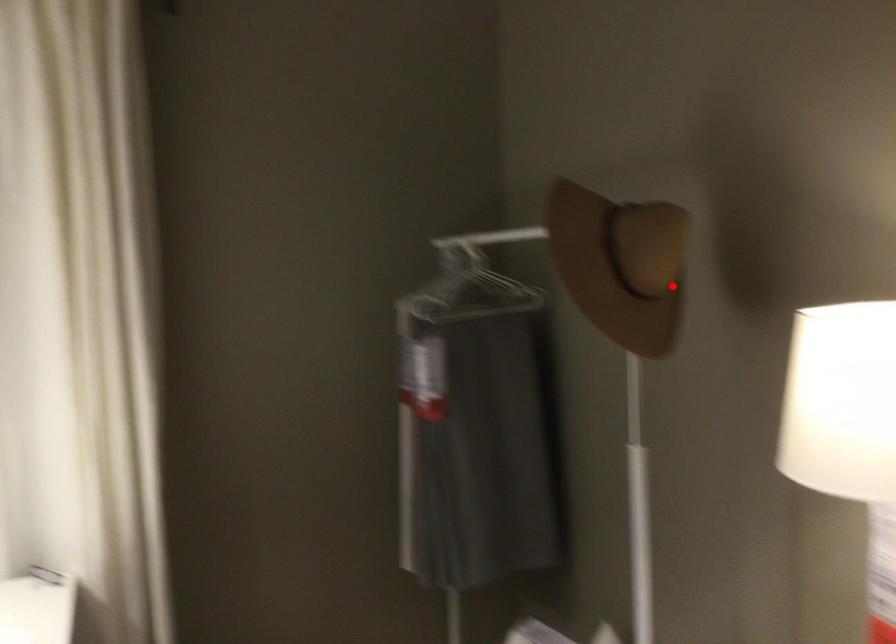
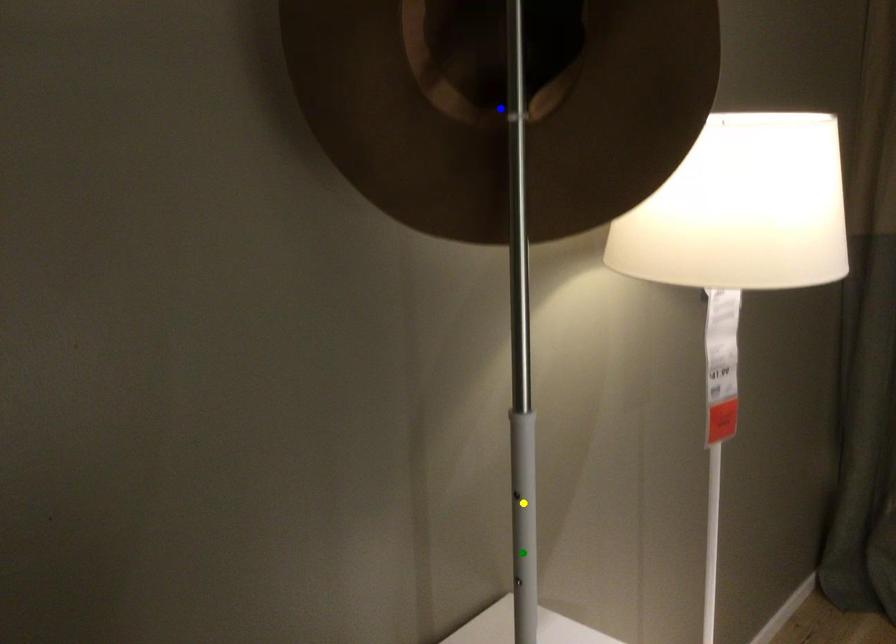
Question: I am providing you with two images of the same scene from different viewpoints. A red point is marked on the first image. You are given multiple points on the second image. Which spot in image 2 lines up with the point in image 1?

Choices:
 (A) yellow point
 (B) green point
 (C) blue point

Answer: (C)